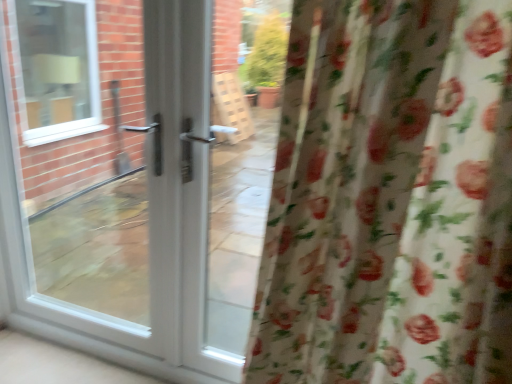
Question: Can you confirm if white glossy door at center is thinner than floral fabric curtain at right?

Choices:
 (A) no
 (B) yes

Answer: (B)

Question: From a real-world perspective, is white glossy door at center under floral fabric curtain at right?

Choices:
 (A) no
 (B) yes

Answer: (B)

Question: Does white glossy door at center have a lesser height compared to floral fabric curtain at right?

Choices:
 (A) no
 (B) yes

Answer: (A)

Question: From the image's perspective, does white glossy door at center appear lower than floral fabric curtain at right?

Choices:
 (A) yes
 (B) no

Answer: (B)

Question: Considering the relative positions of white glossy door at center and floral fabric curtain at right in the image provided, is white glossy door at center to the left of floral fabric curtain at right from the viewer's perspective?

Choices:
 (A) no
 (B) yes

Answer: (B)

Question: From a real-world perspective, is white glossy door at center on floral fabric curtain at right?

Choices:
 (A) yes
 (B) no

Answer: (B)

Question: From a real-world perspective, is floral fabric curtain at right positioned over white glossy door at center based on gravity?

Choices:
 (A) no
 (B) yes

Answer: (B)

Question: Can white glossy door at center be found inside floral fabric curtain at right?

Choices:
 (A) no
 (B) yes

Answer: (A)

Question: Considering the relative sizes of floral fabric curtain at right and white glossy door at center in the image provided, is floral fabric curtain at right shorter than white glossy door at center?

Choices:
 (A) yes
 (B) no

Answer: (A)

Question: From the image's perspective, is floral fabric curtain at right located above white glossy door at center?

Choices:
 (A) yes
 (B) no

Answer: (B)

Question: Could you tell me if floral fabric curtain at right is turned towards white glossy door at center?

Choices:
 (A) no
 (B) yes

Answer: (A)

Question: Can you confirm if floral fabric curtain at right is taller than white glossy door at center?

Choices:
 (A) no
 (B) yes

Answer: (A)

Question: Considering the positions of white glossy door at center and floral fabric curtain at right in the image, is white glossy door at center taller or shorter than floral fabric curtain at right?

Choices:
 (A) short
 (B) tall

Answer: (B)